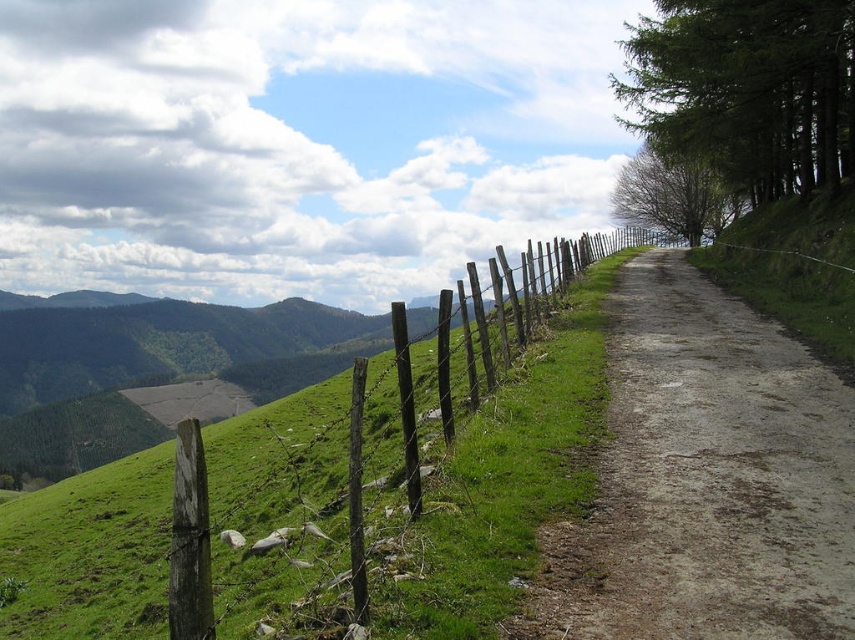
Can you confirm if green grassy at upper left is shorter than dirt/gravel path at center-right?

No.

In order to click on green grassy at upper left in this screenshot , I will do `click(505, 480)`.